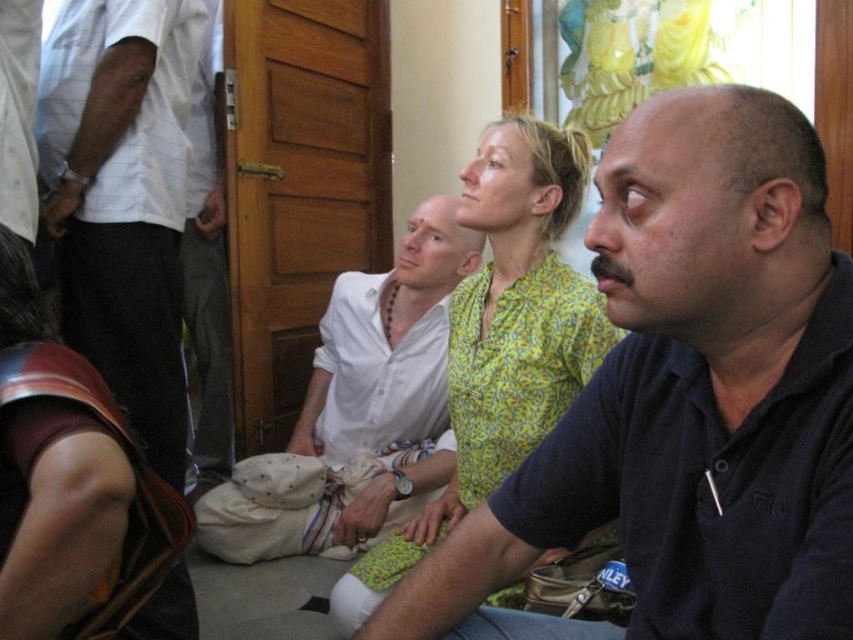
Question: Which is farther from the dark blue polo shirt at center?

Choices:
 (A) white checkered shirt at upper left
 (B) white cotton shirt at center

Answer: (A)

Question: Among these objects, which one is nearest to the camera?

Choices:
 (A) white checkered shirt at upper left
 (B) leather at lower left

Answer: (B)

Question: Which object is the closest to the dark blue polo shirt at center?

Choices:
 (A) leather at lower left
 (B) white cotton shirt at center
 (C) white checkered shirt at upper left

Answer: (A)

Question: Considering the relative positions of dark blue polo shirt at center and white cotton shirt at center in the image provided, where is dark blue polo shirt at center located with respect to white cotton shirt at center?

Choices:
 (A) below
 (B) above

Answer: (B)

Question: Can you confirm if white cotton shirt at center is positioned to the right of leather at lower left?

Choices:
 (A) yes
 (B) no

Answer: (A)

Question: Can you confirm if dark blue polo shirt at center is positioned to the left of white checkered shirt at upper left?

Choices:
 (A) no
 (B) yes

Answer: (A)